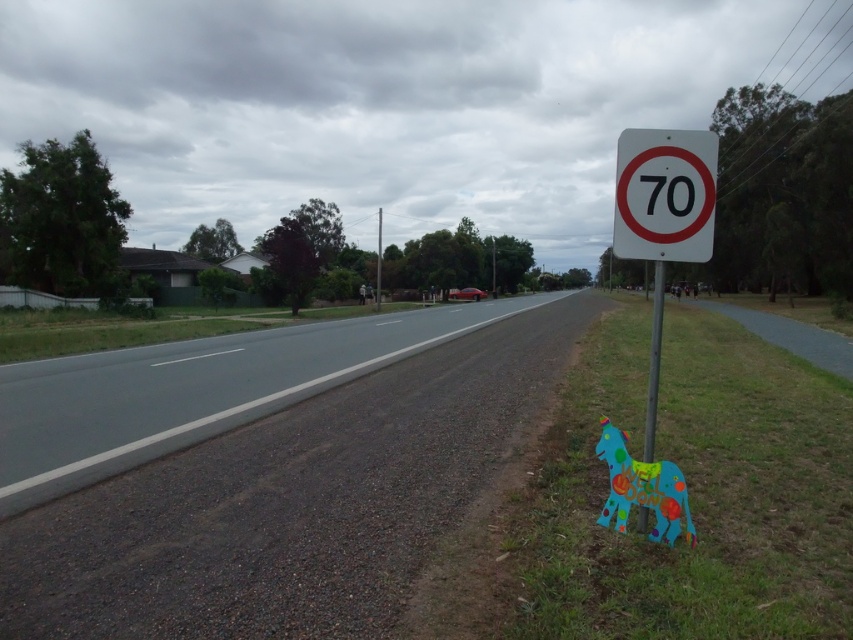
Question: Among these points, which one is farthest from the camera?

Choices:
 (A) (379, 266)
 (B) (634, 132)
 (C) (656, 314)

Answer: (A)

Question: In this image, where is white plastic speed limit sign at right located relative to white plastic speed limit sign at upper right?

Choices:
 (A) above
 (B) below

Answer: (A)

Question: Which point is closer to the camera?

Choices:
 (A) (654, 342)
 (B) (700, 131)
 (C) (376, 273)

Answer: (B)

Question: Considering the real-world distances, which object is farthest from the white plastic speed limit sign at right?

Choices:
 (A) metallic pole at center
 (B) metallic pole at right
 (C) white plastic speed limit sign at upper right

Answer: (A)

Question: Is white plastic speed limit sign at right positioned before metallic pole at right?

Choices:
 (A) yes
 (B) no

Answer: (B)

Question: Can you confirm if white plastic speed limit sign at right is wider than metallic pole at center?

Choices:
 (A) no
 (B) yes

Answer: (B)